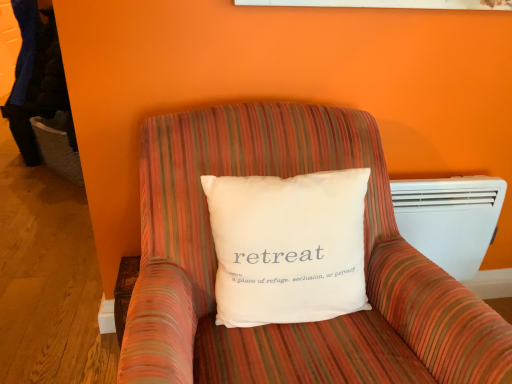
Question: Considering the positions of white cotton pillow at center and striped fabric armchair at center in the image, is white cotton pillow at center taller or shorter than striped fabric armchair at center?

Choices:
 (A) tall
 (B) short

Answer: (B)

Question: From the image's perspective, is white cotton pillow at center positioned above or below striped fabric armchair at center?

Choices:
 (A) below
 (B) above

Answer: (B)

Question: Estimate the real-world distances between objects in this image. Which object is farther from the white plastic heater at right?

Choices:
 (A) striped fabric armchair at center
 (B) white cotton pillow at center

Answer: (B)

Question: Which of these objects is positioned farthest from the striped fabric armchair at center?

Choices:
 (A) white plastic heater at right
 (B) white cotton pillow at center

Answer: (A)